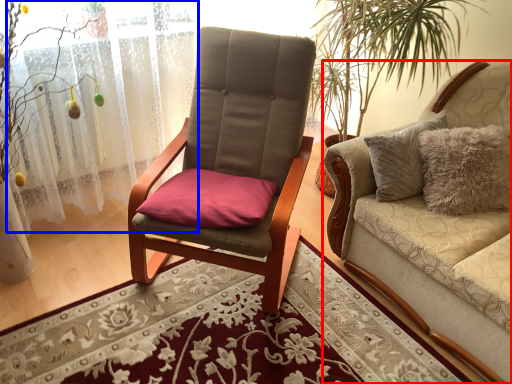
Question: Which point is further to the camera, studio couch (highlighted by a red box) or curtain (highlighted by a blue box)?

Choices:
 (A) studio couch
 (B) curtain

Answer: (B)